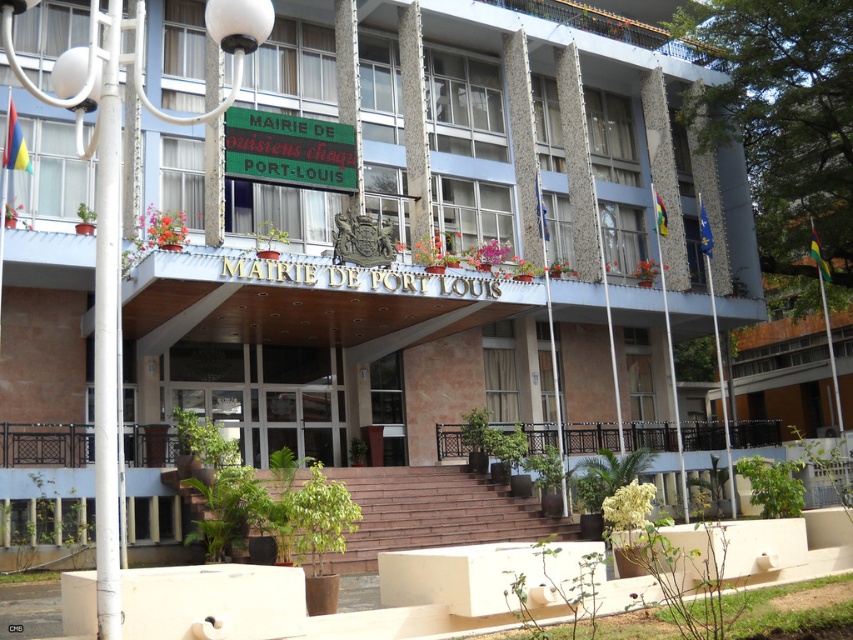
Who is higher up, transparent glass doors at center or green plastic sign at upper center?

Positioned higher is green plastic sign at upper center.

Which is in front, point (268, 436) or point (352, 168)?

Positioned in front is point (352, 168).

You are a GUI agent. You are given a task and a screenshot of the screen. Output one action in this format:
    pyautogui.click(x=<x>, y=<y>)
    Task: Click on the transparent glass doors at center
    The height and width of the screenshot is (640, 853).
    Given the screenshot: What is the action you would take?
    pyautogui.click(x=263, y=396)